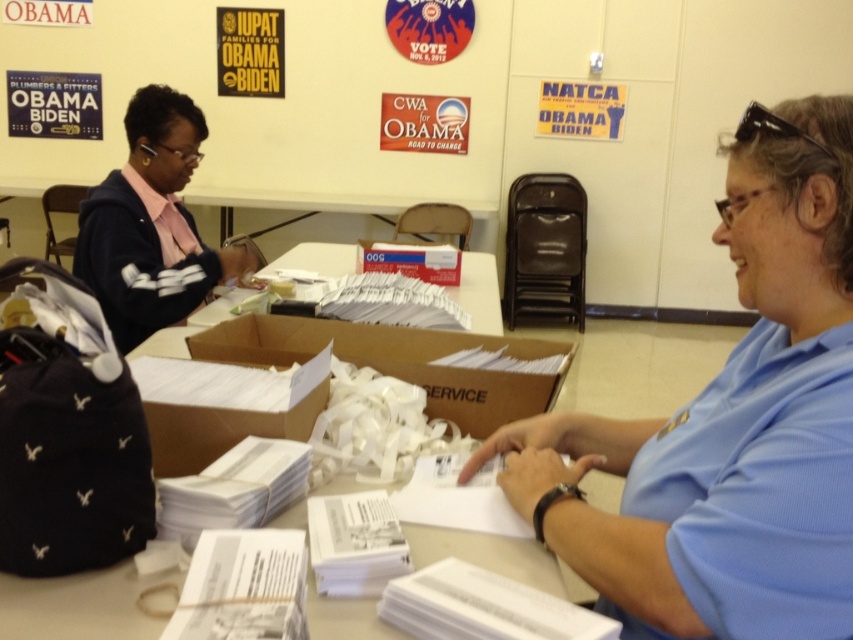
You are a volunteer in this campaign office and need to place a new campaign poster on the wall. The poster is 1 meter wide. The white paper at center is represented by point (85,605). Is there enough space on the wall between the white paper at center and the nearest poster to the right to fit the poster?

The white paper at center is represented by point (85,605). The distance between the white paper at center and the nearest poster to the right is not provided, so it is impossible to determine if there is enough space to fit the 1 meter wide poster.

You are an observer in the campaign office. You see the white paper at center and the dark blue sweater at left. Which object is located more to the right?

The white paper at center is more to the right than the dark blue sweater at left.

You are organizing documents in an Obama Biden campaign office. You have a white paper at center and a cardboard box at center. Which item is wider?

The white paper at center is narrower than the cardboard box at center, so the cardboard box at center is wider.